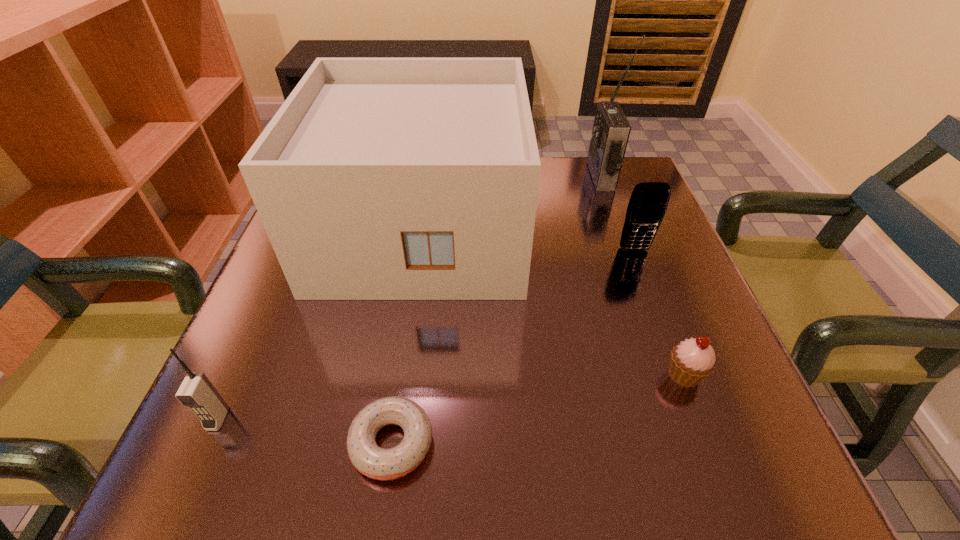
The height and width of the screenshot is (540, 960). In order to click on free space between the leftmost object and the right cellular telephone in this screenshot , I will do `click(426, 334)`.

The width and height of the screenshot is (960, 540). Find the location of `object that ranks as the fifth closest to the radio receiver`. object that ranks as the fifth closest to the radio receiver is located at coordinates (197, 392).

Select which object appears as the fifth closest to the fifth shortest object. Please provide its 2D coordinates. Your answer should be formatted as a tuple, i.e. [(x, y)], where the tuple contains the x and y coordinates of a point satisfying the conditions above.

[(692, 360)]

In order to click on vacant space that satisfies the following two spatial constraints: 1. on the side of the box with the window; 2. on the left side of the shortest object in this screenshot , I will do `click(390, 443)`.

Find the location of `free space that satisfies the following two spatial constraints: 1. on the front-facing side of the nearer cellular telephone; 2. on the right side of the doughnut`. free space that satisfies the following two spatial constraints: 1. on the front-facing side of the nearer cellular telephone; 2. on the right side of the doughnut is located at coordinates (207, 443).

This screenshot has height=540, width=960. Find the location of `free space that satisfies the following two spatial constraints: 1. on the display of the radio receiver; 2. on the right side of the fourth farthest object`. free space that satisfies the following two spatial constraints: 1. on the display of the radio receiver; 2. on the right side of the fourth farthest object is located at coordinates click(x=672, y=375).

Locate an element on the screen. The image size is (960, 540). vacant area in the image that satisfies the following two spatial constraints: 1. on the screen of the farther cellular telephone; 2. on the right side of the fourth farthest object is located at coordinates (681, 375).

The width and height of the screenshot is (960, 540). Identify the location of vacant area that satisfies the following two spatial constraints: 1. on the side of the box with the window; 2. on the right side of the shortest object. (390, 443).

The width and height of the screenshot is (960, 540). In order to click on vacant position in the image that satisfies the following two spatial constraints: 1. on the screen of the farther cellular telephone; 2. on the right side of the fifth tallest object in this screenshot , I will do `click(681, 375)`.

Where is `vacant point that satisfies the following two spatial constraints: 1. on the display of the third nearest object; 2. on the right side of the radio receiver`? Image resolution: width=960 pixels, height=540 pixels. vacant point that satisfies the following two spatial constraints: 1. on the display of the third nearest object; 2. on the right side of the radio receiver is located at coordinates (672, 375).